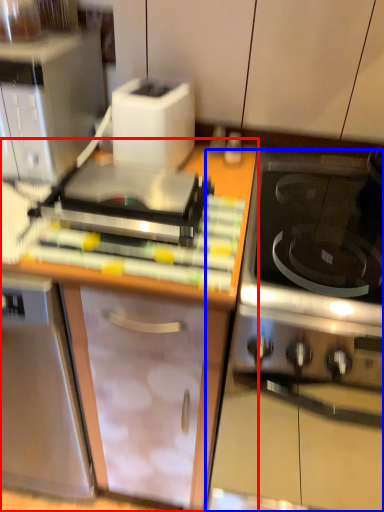
Question: Which of the following is the closest to the observer, cabinetry (highlighted by a red box) or oven (highlighted by a blue box)?

Choices:
 (A) cabinetry
 (B) oven

Answer: (B)